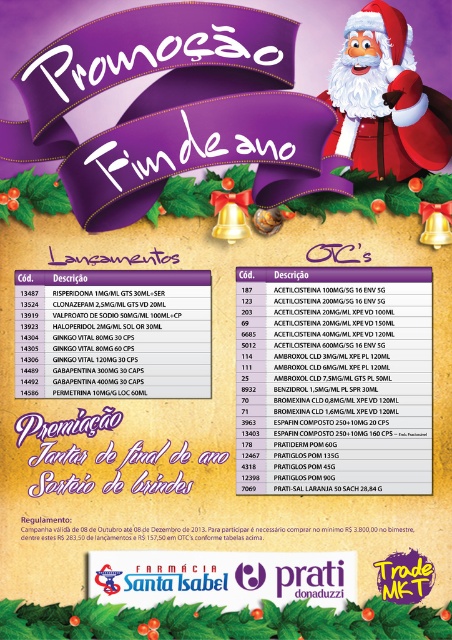
Measure the distance between matte black text at center and camera.

5.44 feet

Who is more distant from viewer, [315,349] or [354,148]?

Positioned behind is point [354,148].

Does point (398, 316) come in front of point (362, 8)?

No, (398, 316) is behind (362, 8).

I want to click on matte black text at center, so click(334, 380).

Does white paper at center have a greater height compared to white paper text at center?

No.

How far apart are white paper at center and white paper text at center?

white paper at center is 10.07 inches away from white paper text at center.

I want to click on white paper at center, so click(x=125, y=340).

Does white plush santa at upper right lie in front of white paper text at center?

Yes, it is in front of white paper text at center.

Consider the image. Does white plush santa at upper right have a lesser width compared to white paper text at center?

In fact, white plush santa at upper right might be wider than white paper text at center.

Which is behind, point (418, 134) or point (323, 326)?

The point (418, 134) is more distant.

Identify the location of white plush santa at upper right. (382, 99).